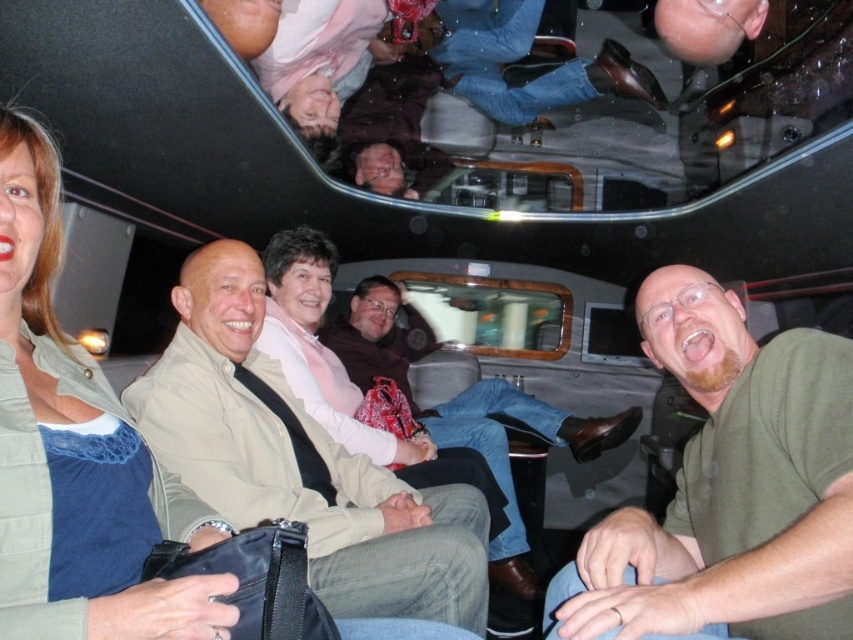
You are a photographer standing in the middle of the vehicle. You want to take a photo of the denim shirt at left and the person sitting next to it. How far apart are they?

The denim shirt at left and the person sitting next to it are 33.53 inches apart.